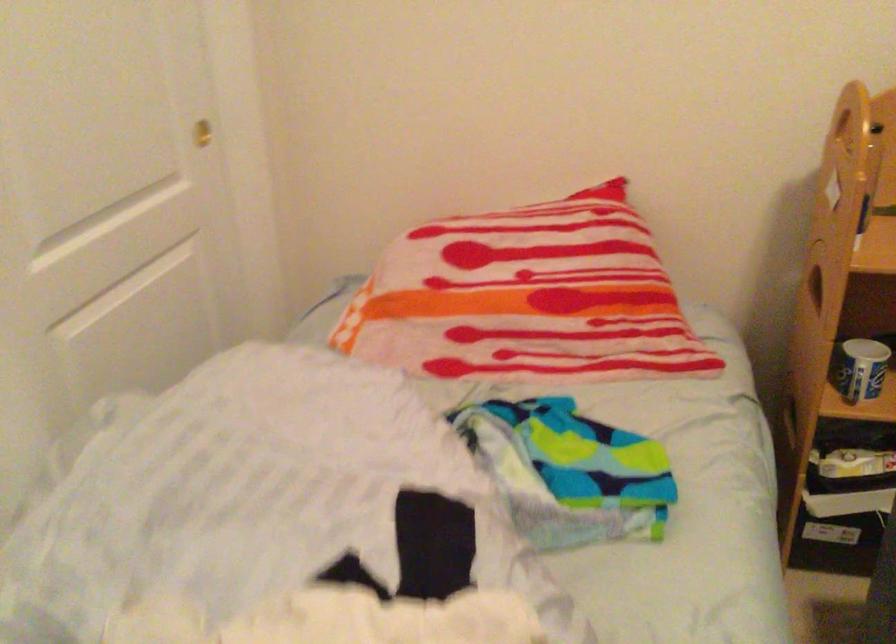
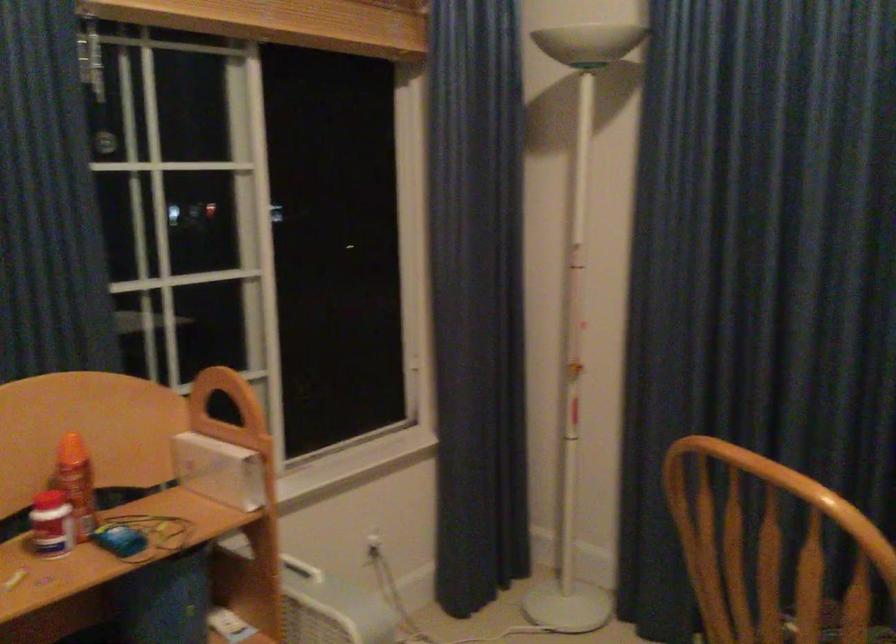
Question: The camera is either moving clockwise (left) or counter-clockwise (right) around the object. The first image is from the beginning of the video and the second image is from the end. Is the camera moving left or right when shooting the video?

Choices:
 (A) Left
 (B) Right

Answer: (A)